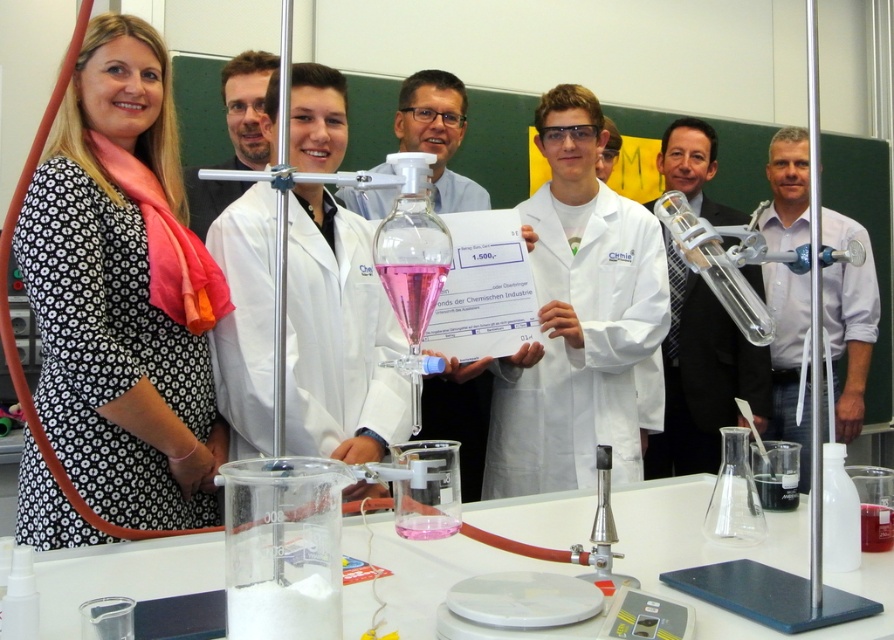
Which is above, clear glass tube at center or white shirt at center?

clear glass tube at center

Measure the distance between point (730, 320) and camera.

The distance of point (730, 320) from camera is 2.74 meters.

You are a GUI agent. You are given a task and a screenshot of the screen. Output one action in this format:
    pyautogui.click(x=<x>, y=<y>)
    Task: Click on the clear glass tube at center
    Image resolution: width=894 pixels, height=640 pixels.
    Given the screenshot: What is the action you would take?
    pyautogui.click(x=702, y=378)

Does clear glass tube at center have a lesser width compared to matte black lab coat at center?

No, clear glass tube at center is not thinner than matte black lab coat at center.

The image size is (894, 640). Describe the element at coordinates (702, 378) in the screenshot. I see `clear glass tube at center` at that location.

Between point (758, 364) and point (201, 214), which one is positioned in front?

Point (201, 214)

Where is `clear glass tube at center`? The height and width of the screenshot is (640, 894). clear glass tube at center is located at coordinates (702, 378).

Does black floral dress at left appear on the right side of matte black lab coat at center?

In fact, black floral dress at left is to the left of matte black lab coat at center.

Who is shorter, black floral dress at left or matte black lab coat at center?

Standing shorter between the two is matte black lab coat at center.

Identify the location of black floral dress at left. (123, 291).